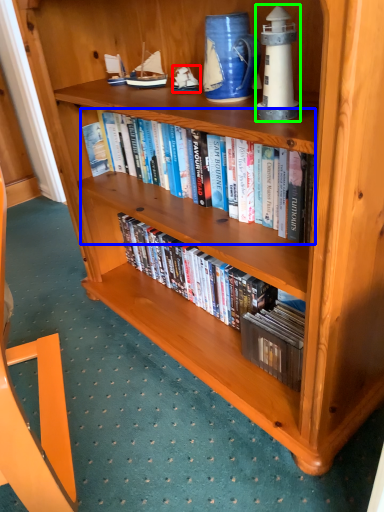
Question: Based on their relative distances, which object is nearer to toy (highlighted by a red box)? Choose from book (highlighted by a blue box) and toy (highlighted by a green box).

Choices:
 (A) book
 (B) toy

Answer: (A)